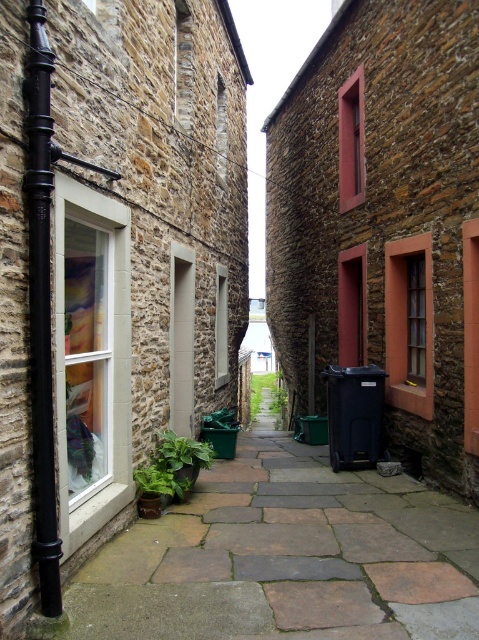
You are standing at the entrance of the alleyway and notice two points marked on the ground. The first point is at coordinate point (163, 460) and the second is at point (265, 381). Which point is closer to you as you face into the alley?

Point (163, 460) is closer to the camera than point (265, 381), so the first point is closer to you as you face into the alley.

You are a photographer standing at the camera position in the alleyway. You want to capture a photo of the green matte plant at lower left. Can you fit the entire plant into your camera frame without moving your position? The camera has a field of view of 10 feet.

The distance between you and the green matte plant at lower left is 17.68 feet, which exceeds the camera field of view of 10 feet. Therefore, you cannot capture the entire plant in the frame without moving closer.

You are a delivery person carrying a box that is 1 meter wide. You need to navigate through the narrow alleyway between the two stone buildings. There are two plants in your path, the green matte plant at lower left and the green leafy plant at center. Can you pass through the alley without hitting either plant?

The green matte plant at lower left is thinner than the green leafy plant at center. Since the box is 1 meter wide, you should be able to pass through the alley as long as you stay between the two plants, avoiding the wider green leafy plant at center which may require more space.